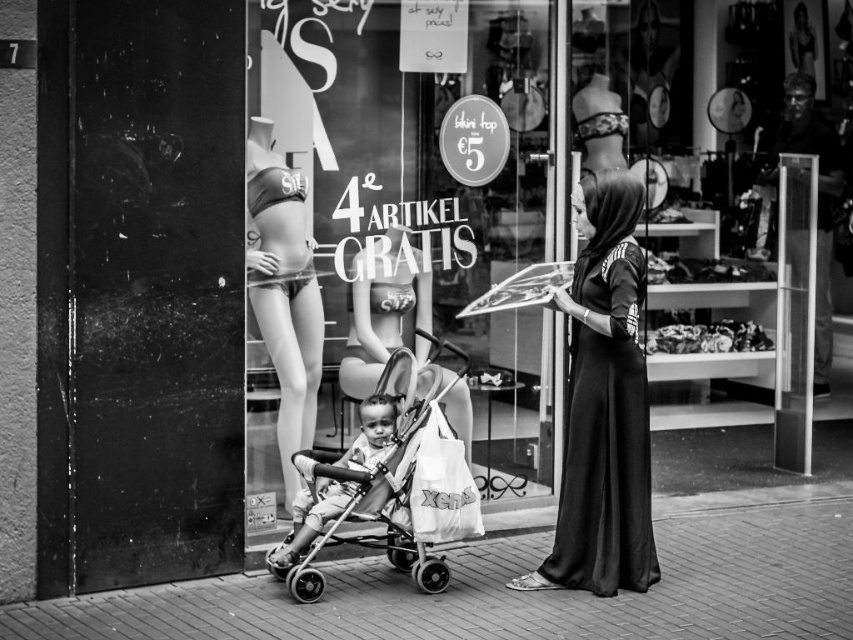
You are a customer standing in front of the lingerie store. You see the black silk abaya at center and the smooth skin mannequin at center. Which item is positioned to the right side?

The black silk abaya at center is positioned to the right of the smooth skin mannequin at center.

You are a delivery person trying to place a large package between the transparent glass at center and the metallic stroller at center. The package is 1 meter long. Can you fit it there?

The transparent glass at center is 1.06 meters away from the metallic stroller at center, so yes, the package can fit between them since the distance is slightly more than the package length.

Looking at this image, what is located at the coordinates point (424, 195) in the scene?

The transparent glass at center is located at point (424, 195).